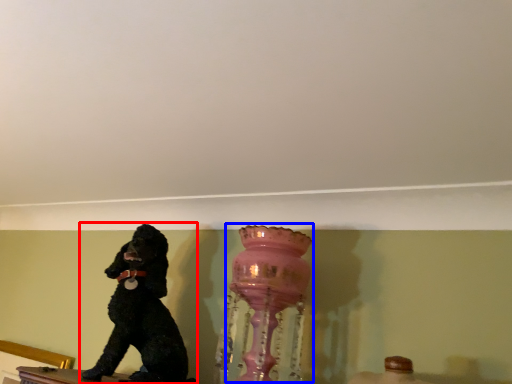
Question: Which object is further to the camera taking this photo, dog (highlighted by a red box) or vase (highlighted by a blue box)?

Choices:
 (A) dog
 (B) vase

Answer: (A)